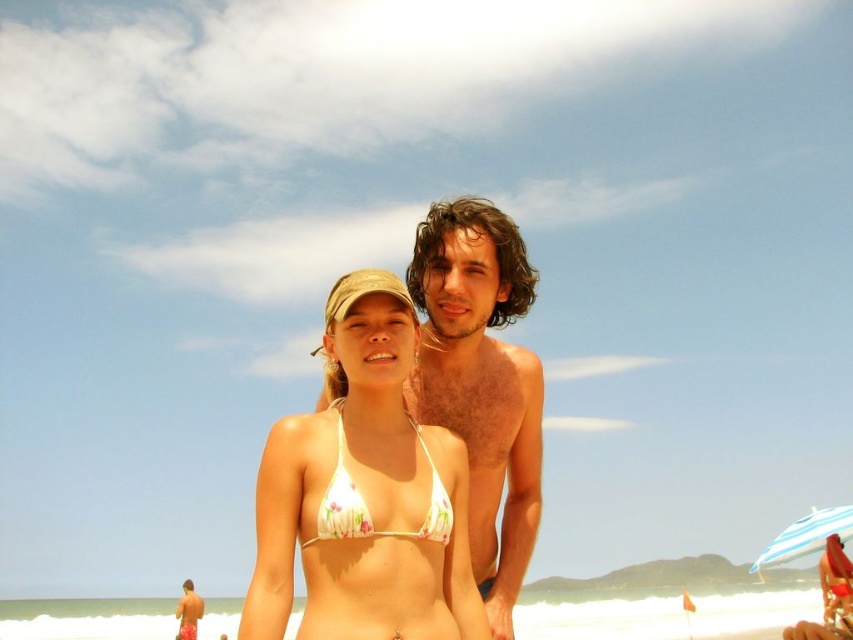
Question: Does smooth skin man at center appear over tan skin man at lower left?

Choices:
 (A) no
 (B) yes

Answer: (B)

Question: Which point appears closest to the camera in this image?

Choices:
 (A) (433, 477)
 (B) (363, 392)

Answer: (A)

Question: Which point is closer to the camera?

Choices:
 (A) floral print bikini top at center
 (B) tan skin man at lower left
 (C) striped fabric umbrella at lower right
 (D) smooth skin man at center

Answer: (A)

Question: Observing the image, what is the correct spatial positioning of white floral bikini top at center in reference to smooth skin man at center?

Choices:
 (A) below
 (B) above

Answer: (A)

Question: Is white floral bikini top at center closer to camera compared to striped fabric umbrella at lower right?

Choices:
 (A) no
 (B) yes

Answer: (B)

Question: Which object appears farthest from the camera in this image?

Choices:
 (A) floral print bikini top at center
 (B) striped fabric umbrella at lower right
 (C) smooth skin man at center
 (D) tan skin man at lower left

Answer: (D)